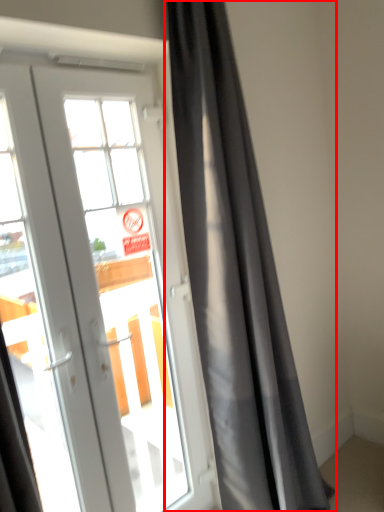
Question: Considering the relative positions of curtain (annotated by the red box) and door in the image provided, where is curtain (annotated by the red box) located with respect to the staircase?

Choices:
 (A) left
 (B) right

Answer: (B)